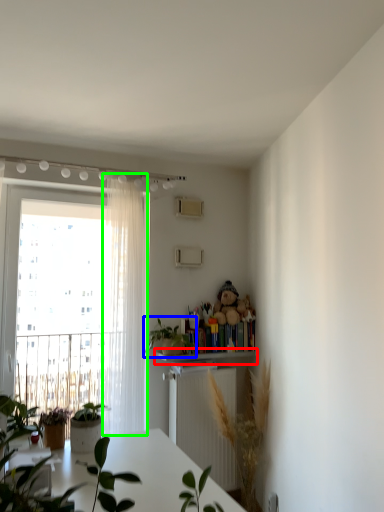
Question: Based on their relative distances, which object is nearer to shelf (highlighted by a red box)? Choose from houseplant (highlighted by a blue box) and curtain (highlighted by a green box).

Choices:
 (A) houseplant
 (B) curtain

Answer: (A)